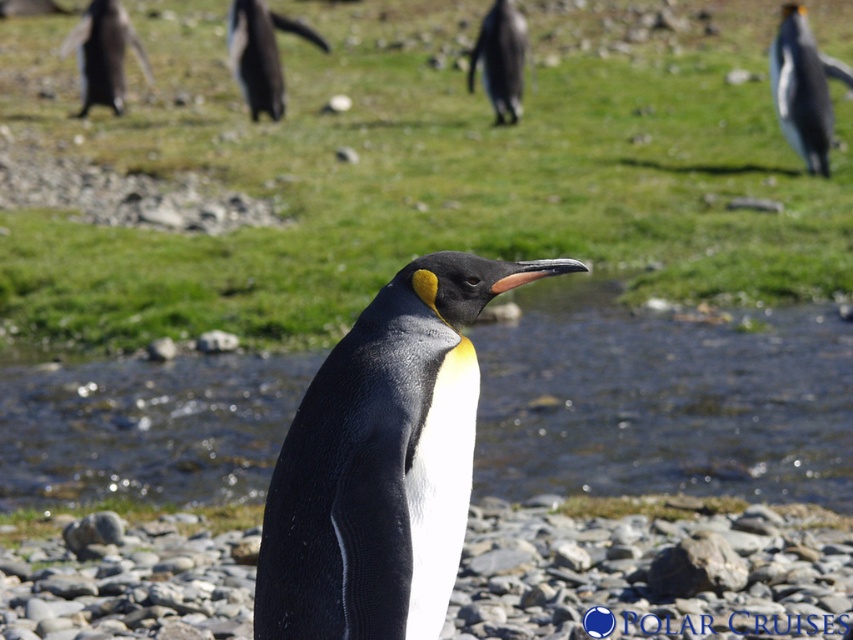
You are a photographer trying to capture a close shot of the black glossy penguin at upper left without the black smooth rock at center blocking the view. Based on their sizes, can you determine if the rock is wider than the penguin?

The black smooth rock at center is wider than the black glossy penguin at upper left according to the description, so the rock might block the penguin if positioned between them.

In the scene, there is clear water at center and a black glossy penguin at upper right. From the perspective of someone standing in front of the image, which object is positioned to the left of the other?

The clear water at center is to the left of the black glossy penguin at upper right.

You are a photographer trying to capture the black glossy penguin at upper right and the clear water at center in a single shot. Which object occupies more horizontal space in the image?

The black glossy penguin at upper right occupies more horizontal space in the image than the clear water at center, as the clear water at center has a lesser width compared to the penguin.